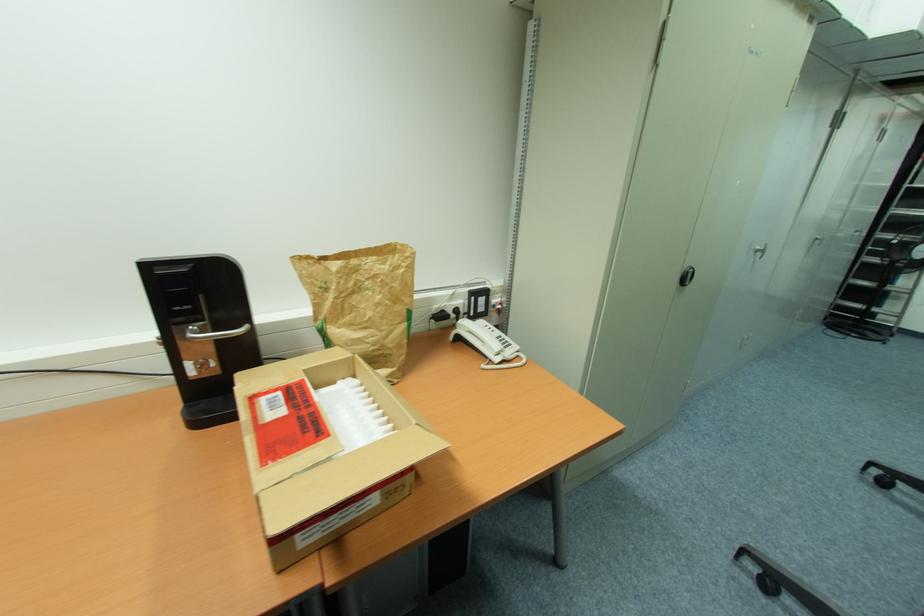
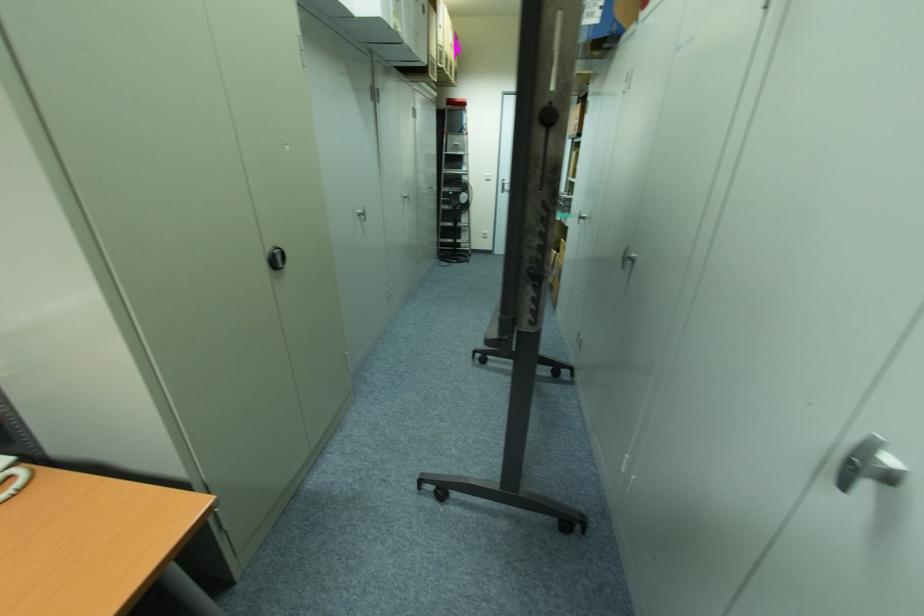
The point at [686,280] is marked in the first image. Where is the corresponding point in the second image?

(278, 262)